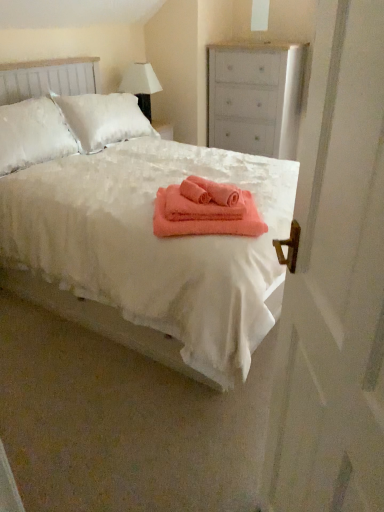
Question: Would you say coral soft towel at center, the second bath towel when ordered from top to bottom, is inside or outside white matte screen door at right?

Choices:
 (A) outside
 (B) inside

Answer: (A)

Question: Is point (226, 226) closer or farther from the camera than point (374, 290)?

Choices:
 (A) closer
 (B) farther

Answer: (B)

Question: Which is farther from the white fabric lampshade at upper center?

Choices:
 (A) white matte screen door at right
 (B) white fluffy bed at center
 (C) white matte chest of drawers at upper right
 (D) coral soft towel at center, the second bath towel when ordered from top to bottom
 (E) coral soft towel at center, which appears as the first bath towel when viewed from the top

Answer: (A)

Question: Estimate the real-world distances between objects in this image. Which object is farther from the white matte screen door at right?

Choices:
 (A) white matte chest of drawers at upper right
 (B) coral soft towel at center, the second bath towel when ordered from top to bottom
 (C) coral soft towel at center, the 2th bath towel ordered from the bottom
 (D) white fabric lampshade at upper center
 (E) white fluffy bed at center

Answer: (D)